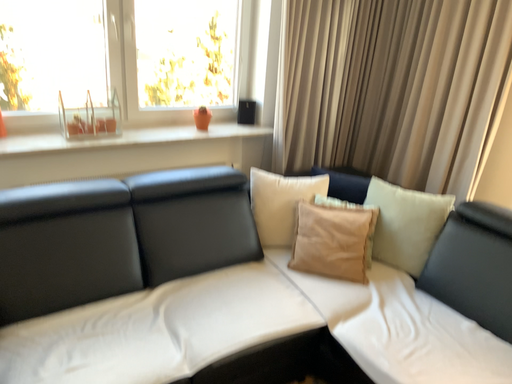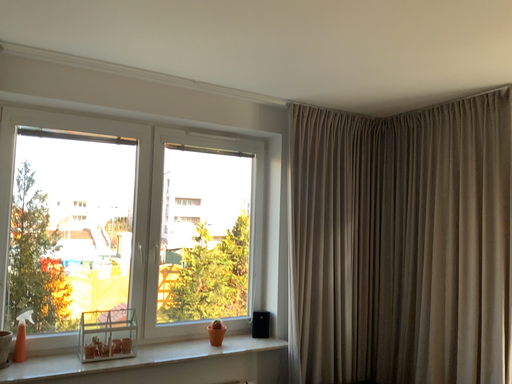
Question: Which way did the camera rotate in the video?

Choices:
 (A) rotated upward
 (B) rotated downward

Answer: (A)